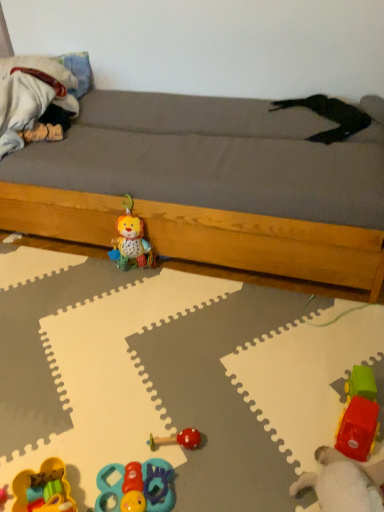
Identify the location of vacant space situated above rubberized blue and red toy at lower center, which appears as the third toy when viewed from the left (from a real-world perspective). The height and width of the screenshot is (512, 384). (137, 479).